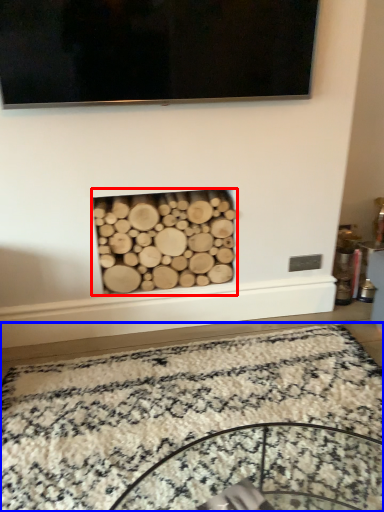
Question: Which of the following is the closest to the observer, fireplace (highlighted by a red box) or mat (highlighted by a blue box)?

Choices:
 (A) fireplace
 (B) mat

Answer: (B)